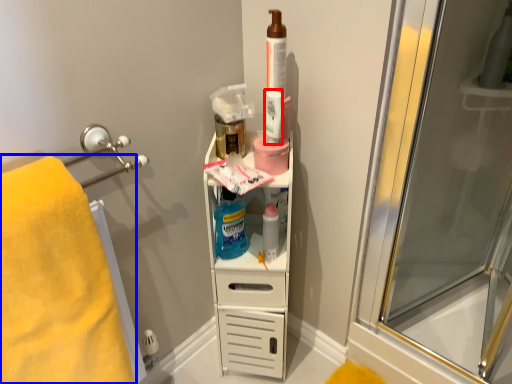
Question: Which object is further to the camera taking this photo, mouthwash (highlighted by a red box) or towel (highlighted by a blue box)?

Choices:
 (A) mouthwash
 (B) towel

Answer: (A)